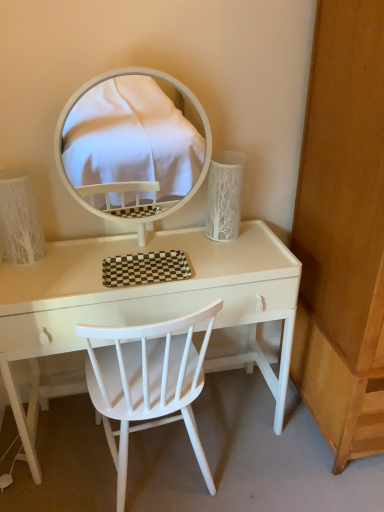
Find the location of a particular element. free point to the left of white textured vase at right, which is the 2th table lamp from left to right is located at coordinates (188, 241).